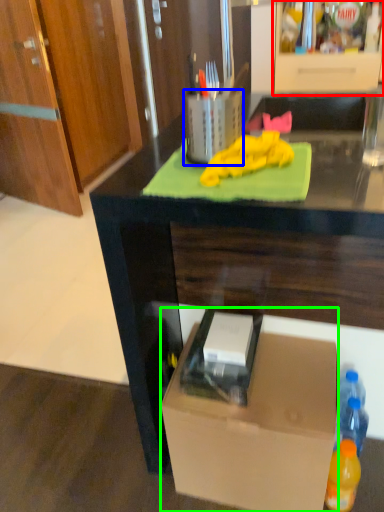
Question: Considering the real-world distances, which object is farthest from cabinetry (highlighted by a red box)? appliance (highlighted by a blue box) or box (highlighted by a green box)?

Choices:
 (A) appliance
 (B) box

Answer: (B)